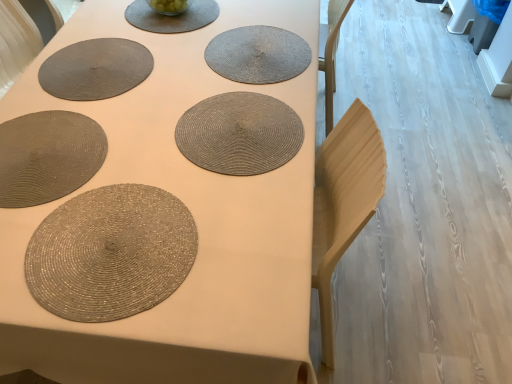
Find the location of a particular element. vacant space that is to the left of rattan placemat at center, arranged as the 2th coaster when ordered from the bottom is located at coordinates (168, 52).